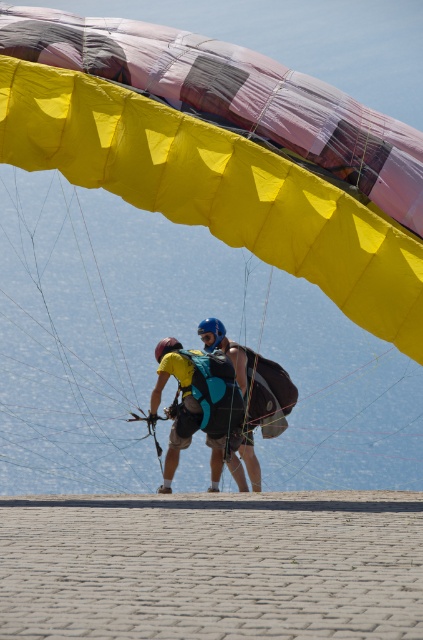
Which is in front, point (225, 432) or point (242, 476)?

Positioned in front is point (225, 432).

Does point (214, 454) lie in front of point (216, 460)?

That is True.

Is point (175, 371) farther from camera compared to point (228, 467)?

No, it is not.

Find the location of `yellow matte helmet at upper center`. yellow matte helmet at upper center is located at coordinates (181, 403).